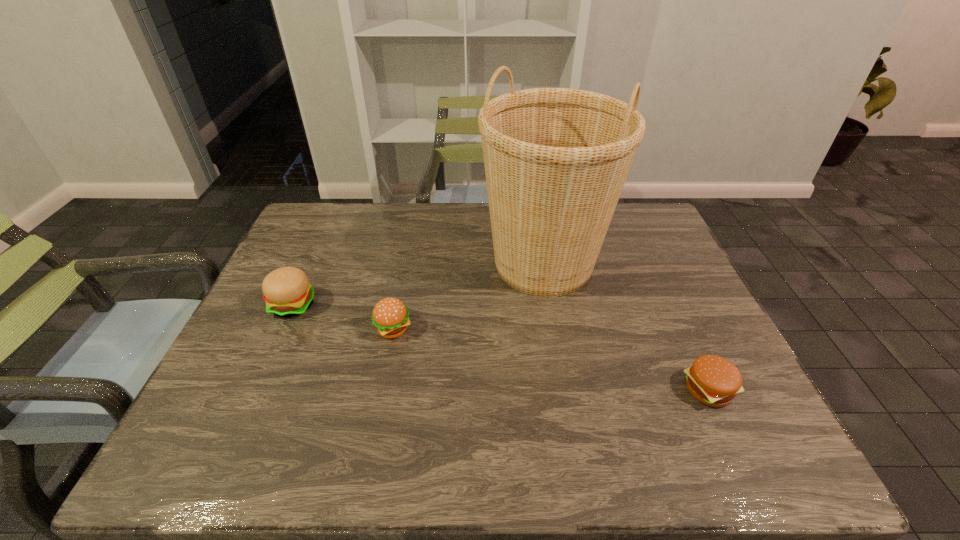
Find the location of a particular element. free region located on the left of the shortest hamburger is located at coordinates (564, 390).

The width and height of the screenshot is (960, 540). In order to click on object at the far edge in this screenshot , I will do pos(556,159).

The height and width of the screenshot is (540, 960). Identify the location of object located at the left edge. (287, 292).

The width and height of the screenshot is (960, 540). Find the location of `object present at the right edge`. object present at the right edge is located at coordinates (714, 381).

Image resolution: width=960 pixels, height=540 pixels. In order to click on vacant space at the far edge of the desktop in this screenshot , I will do `click(360, 244)`.

In the image, there is a desktop. Where is `vacant space at the near edge`? vacant space at the near edge is located at coordinates (468, 458).

In order to click on vacant space at the left edge of the desktop in this screenshot , I will do `click(317, 284)`.

Find the location of a particular element. This screenshot has height=540, width=960. free space at the right edge of the desktop is located at coordinates (728, 408).

Find the location of a particular element. The image size is (960, 540). vacant space at the far left corner of the desktop is located at coordinates (318, 204).

In the image, there is a desktop. Where is `vacant space at the far right corner`? The image size is (960, 540). vacant space at the far right corner is located at coordinates (617, 227).